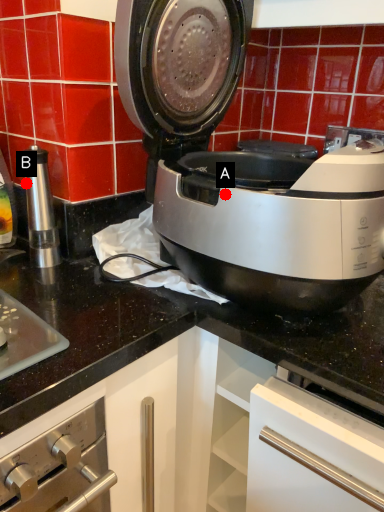
Question: Two points are circled on the image, labeled by A and B beside each circle. Which point is further to the camera?

Choices:
 (A) A is further
 (B) B is further

Answer: (B)